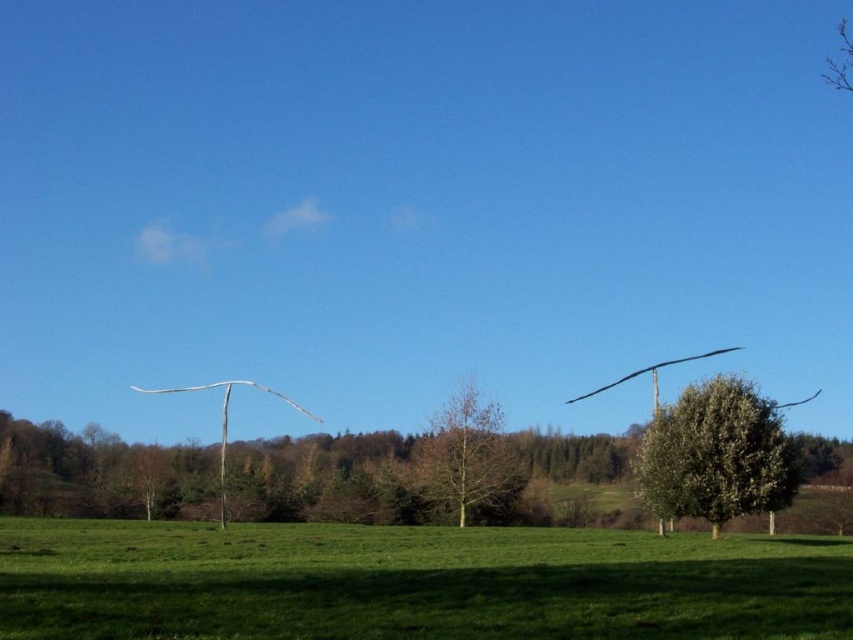
Question: Which point appears farthest from the camera in this image?

Choices:
 (A) (666, 483)
 (B) (624, 566)

Answer: (A)

Question: Can you confirm if green leafy tree at right is positioned below bare wood tree at center?

Choices:
 (A) no
 (B) yes

Answer: (A)

Question: Can you confirm if green grassy field at lower center is smaller than bare wood tree at center?

Choices:
 (A) no
 (B) yes

Answer: (A)

Question: Which point is farther to the camera?

Choices:
 (A) bare wood tree at center
 (B) green grassy field at lower center

Answer: (A)

Question: Is green grassy field at lower center smaller than bare wood tree at center?

Choices:
 (A) yes
 (B) no

Answer: (B)

Question: Estimate the real-world distances between objects in this image. Which object is closer to the bare wood tree at center?

Choices:
 (A) green grassy field at lower center
 (B) green leafy tree at right

Answer: (B)